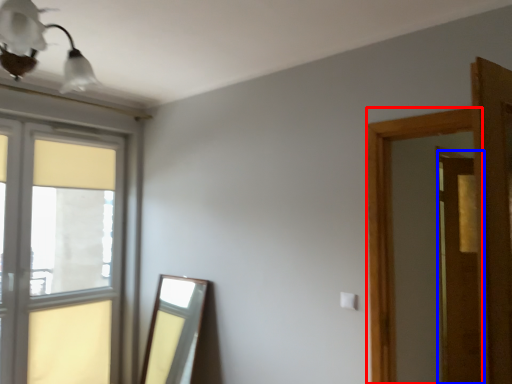
Question: Which object is further to the camera taking this photo, window frame (highlighted by a red box) or screen door (highlighted by a blue box)?

Choices:
 (A) window frame
 (B) screen door

Answer: (B)